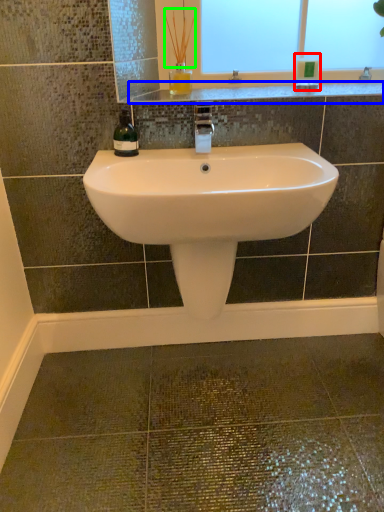
Question: Considering the real-world distances, which object is closest to toiletry (highlighted by a red box)? counter top (highlighted by a blue box) or plant (highlighted by a green box).

Choices:
 (A) counter top
 (B) plant

Answer: (A)